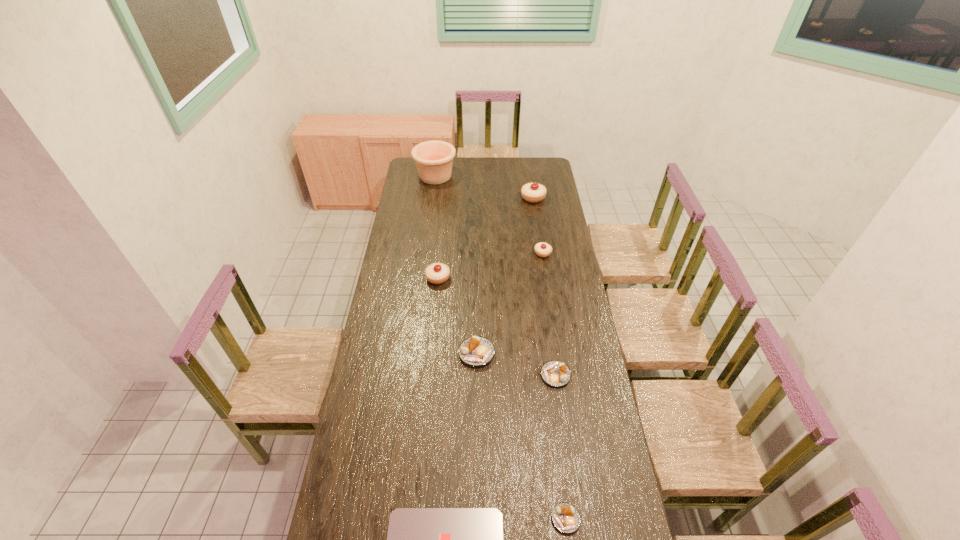
Select which brown pastry is the closest to the leftmost brown pastry. Please provide its 2D coordinates. Your answer should be formatted as a tuple, i.e. [(x, y)], where the tuple contains the x and y coordinates of a point satisfying the conditions above.

[(555, 373)]

In order to click on vacant position in the image that satisfies the following two spatial constraints: 1. on the front side of the fourth tallest pastry; 2. on the right side of the smallest brown pastry in this screenshot , I will do click(475, 519).

Where is `vacant space that satisfies the following two spatial constraints: 1. on the front side of the fourth farthest object; 2. on the left side of the nearest brown pastry`? vacant space that satisfies the following two spatial constraints: 1. on the front side of the fourth farthest object; 2. on the left side of the nearest brown pastry is located at coordinates (416, 519).